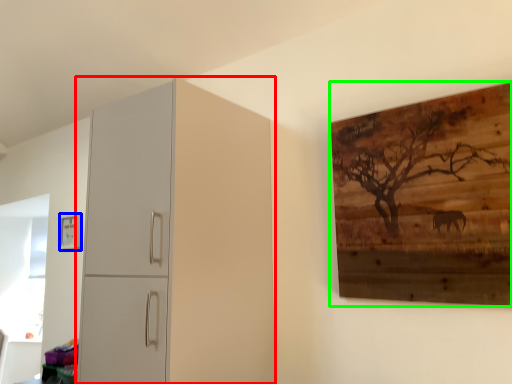
Question: Estimate the real-world distances between objects in this image. Which object is farther from cupboard (highlighted by a red box), picture frame (highlighted by a blue box) or picture frame (highlighted by a green box)?

Choices:
 (A) picture frame
 (B) picture frame

Answer: (A)